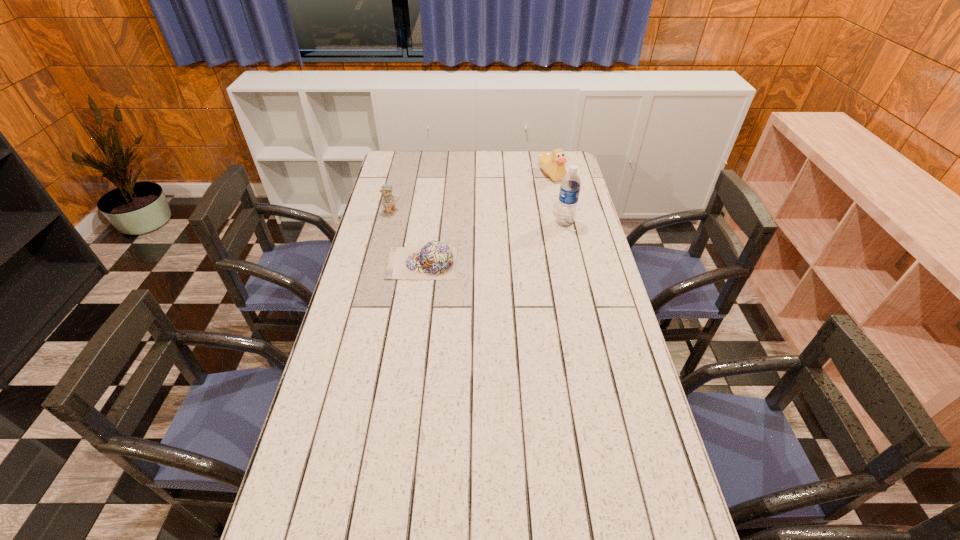
The width and height of the screenshot is (960, 540). Find the location of `cap`. cap is located at coordinates (436, 260).

Locate an element on the screen. This screenshot has height=540, width=960. the nearest object is located at coordinates (436, 260).

What are the coordinates of `the tallest object` in the screenshot? It's located at (570, 186).

Identify the location of the third farthest object. This screenshot has width=960, height=540. (570, 186).

In order to click on teddy bear in this screenshot , I will do `click(389, 200)`.

Locate an element on the screen. This screenshot has width=960, height=540. the farthest object is located at coordinates (552, 164).

Identify the location of free space located 0.090m on the front, side, and top of the shortest object. This screenshot has width=960, height=540. (362, 264).

You are a GUI agent. You are given a task and a screenshot of the screen. Output one action in this format:
    pyautogui.click(x=<x>, y=<y>)
    Task: Click on the free space located 0.090m on the front, side, and top of the shortest object
    
    Given the screenshot: What is the action you would take?
    pyautogui.click(x=362, y=264)

Where is `free point located 0.160m on the left of the third farthest object`? The width and height of the screenshot is (960, 540). free point located 0.160m on the left of the third farthest object is located at coordinates (516, 223).

Locate an element on the screen. Image resolution: width=960 pixels, height=540 pixels. vacant space located 0.310m on the front-facing side of the second farthest object is located at coordinates (460, 241).